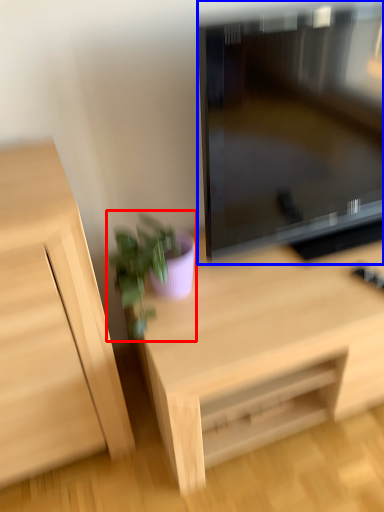
Question: Which object is further to the camera taking this photo, houseplant (highlighted by a red box) or television (highlighted by a blue box)?

Choices:
 (A) houseplant
 (B) television

Answer: (A)